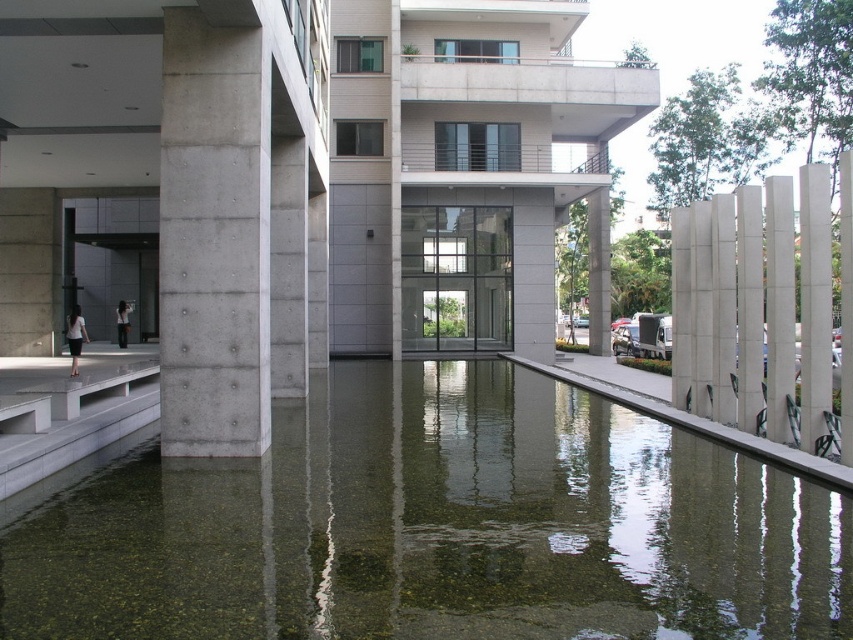
You are standing at the entrance of the modern building and looking towards the water feature. There are two points marked on the ground in front of you, one at point coordinates point (186, 584) and the other at point coordinates point (231, 224). Which point is closer to your current position?

Point (186, 584) is closer to the camera than point (231, 224), so the point at coordinates point (186, 584) is closer to your current position.

You are an architect designing a new layout for the area around the clear concrete pool at center and the gray concrete pillar at center. If you want to place a small bench between them, which object should the bench be closer to to ensure it doesn

The bench should be closer to the gray concrete pillar at center because the clear concrete pool at center is larger in size, so positioning the bench nearer to the pillar would maintain balance in the design.

You are designing a new pathway that needs to be placed between the clear concrete pool at center and the gray concrete pillar at center. The pathway must be 2 meters wide. Can the space between them accommodate this pathway?

The clear concrete pool at center is wider than the gray concrete pillar at center. However, the exact dimensions of the space between them are not provided in the description. Therefore, it is uncertain if the 2 meter wide pathway can fit without further measurements.